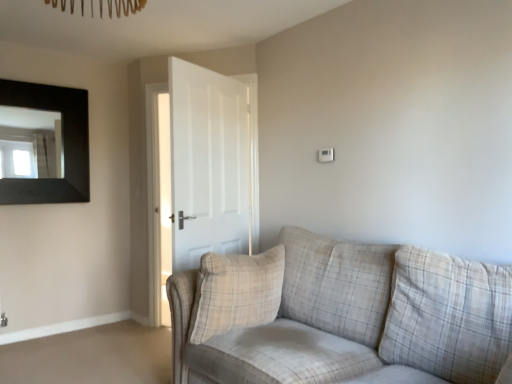
Question: Is white matte door at center wider or thinner than beige plaid pillow at center?

Choices:
 (A) thin
 (B) wide

Answer: (A)

Question: From the image's perspective, is white matte door at center positioned above or below beige plaid pillow at center?

Choices:
 (A) above
 (B) below

Answer: (A)

Question: Based on their relative distances, which object is nearer to the beige plaid pillow at center?

Choices:
 (A) black matte picture frame at upper left
 (B) white matte door at center
 (C) plaid fabric couch at center

Answer: (C)

Question: Considering the real-world distances, which object is closest to the beige plaid pillow at center?

Choices:
 (A) plaid fabric couch at center
 (B) white matte door at center
 (C) black matte picture frame at upper left

Answer: (A)